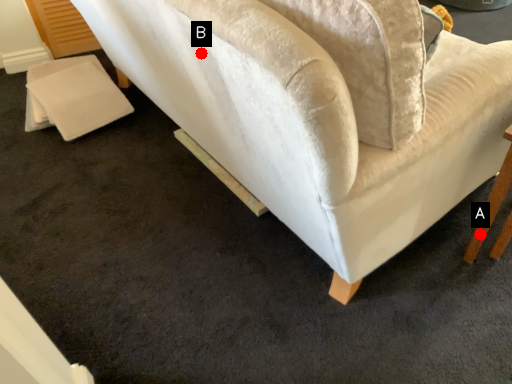
Question: Two points are circled on the image, labeled by A and B beside each circle. Which point is closer to the camera?

Choices:
 (A) A is closer
 (B) B is closer

Answer: (B)